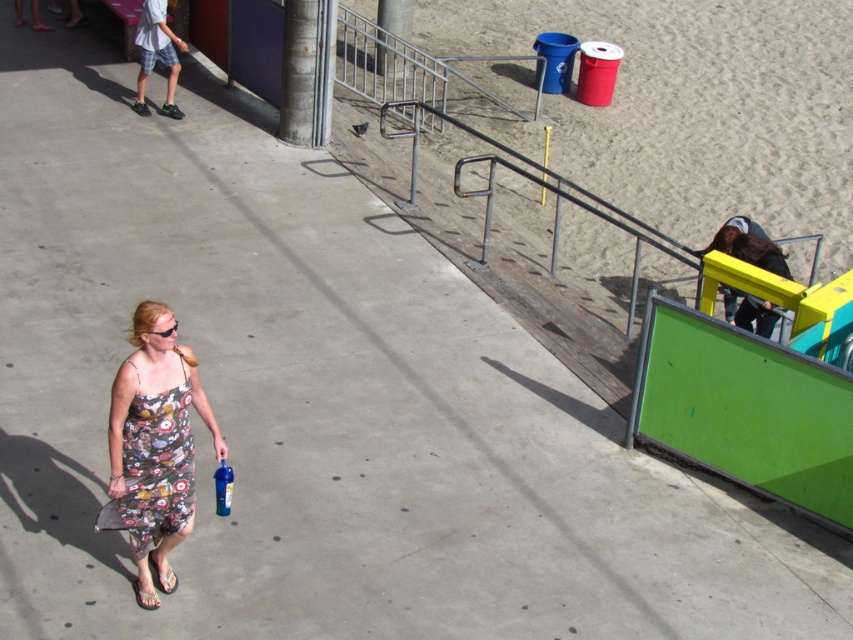
Looking at this image, who is taller, floral print fabric dress at lower left or plaid shorts at upper left?

plaid shorts at upper left is taller.

The width and height of the screenshot is (853, 640). Find the location of `floral print fabric dress at lower left`. floral print fabric dress at lower left is located at coordinates (154, 468).

The image size is (853, 640). What are the coordinates of `floral print fabric dress at lower left` in the screenshot? It's located at (154, 468).

Identify the location of floral print fabric dress at lower left. (154, 468).